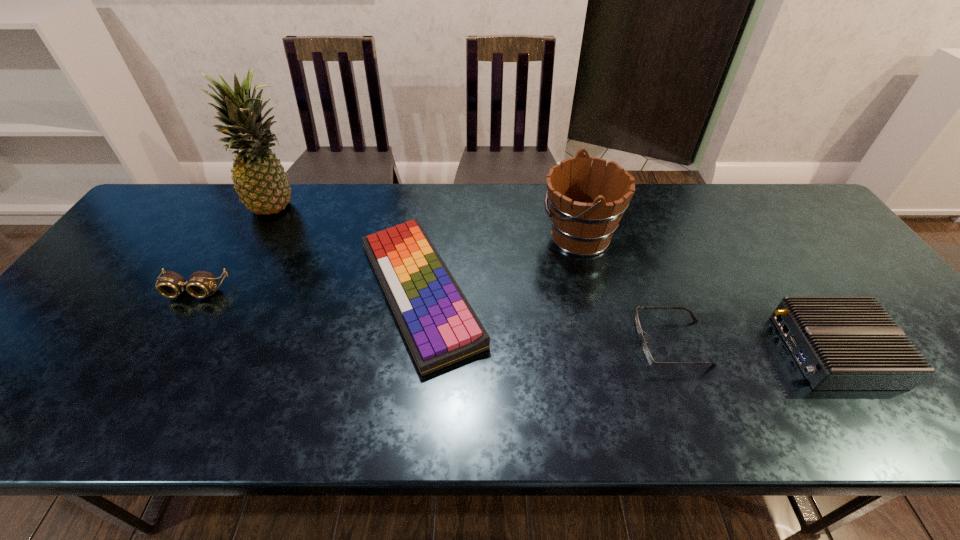
Find the location of a particular element. This screenshot has height=540, width=960. empty location between the fifth shortest object and the tallest object is located at coordinates (429, 221).

Locate an element on the screen. Image resolution: width=960 pixels, height=540 pixels. free spot between the fifth tallest object and the rightmost object is located at coordinates (627, 322).

Locate an element on the screen. The image size is (960, 540). blank region between the fourth object from right to left and the spectacles is located at coordinates (546, 318).

Locate an element on the screen. The image size is (960, 540). object identified as the fifth closest to the shortest object is located at coordinates (171, 285).

You are a GUI agent. You are given a task and a screenshot of the screen. Output one action in this format:
    pyautogui.click(x=<x>, y=<y>)
    Task: Click on the object that stands as the second closest to the third shortest object
    
    Given the screenshot: What is the action you would take?
    pyautogui.click(x=440, y=327)

Identify the location of vacant space that satisfies the following two spatial constraints: 1. through the lenses of the fifth tallest object; 2. on the right side of the goggles. This screenshot has width=960, height=540. (193, 292).